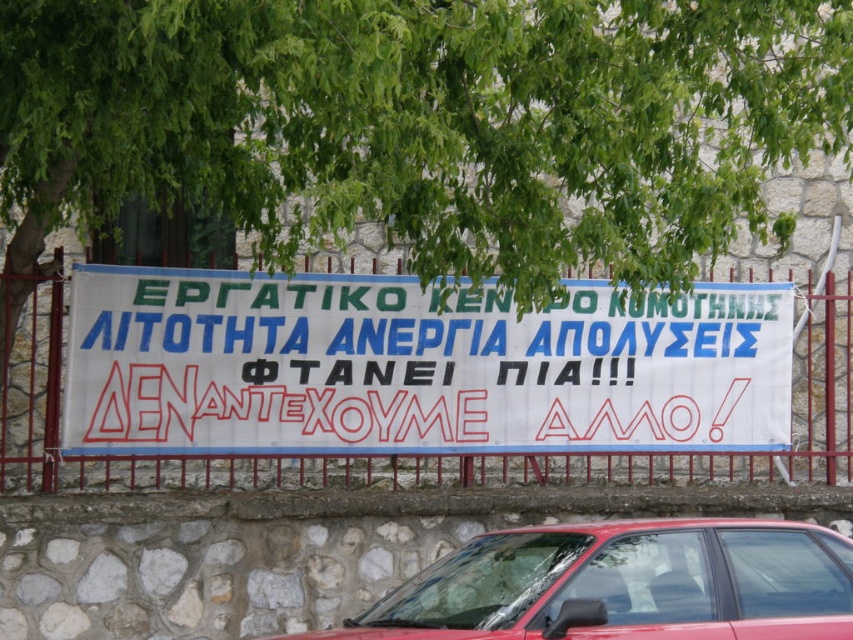
Question: Among these points, which one is farthest from the camera?

Choices:
 (A) (247, 426)
 (B) (781, 634)

Answer: (A)

Question: Can you confirm if white paper banner at center is positioned above shiny red car at center?

Choices:
 (A) no
 (B) yes

Answer: (B)

Question: Is white paper banner at center to the right of shiny red car at center from the viewer's perspective?

Choices:
 (A) yes
 (B) no

Answer: (B)

Question: Among these objects, which one is farthest from the camera?

Choices:
 (A) white paper banner at center
 (B) shiny red car at center

Answer: (A)

Question: Does white paper banner at center appear on the right side of shiny red car at center?

Choices:
 (A) no
 (B) yes

Answer: (A)